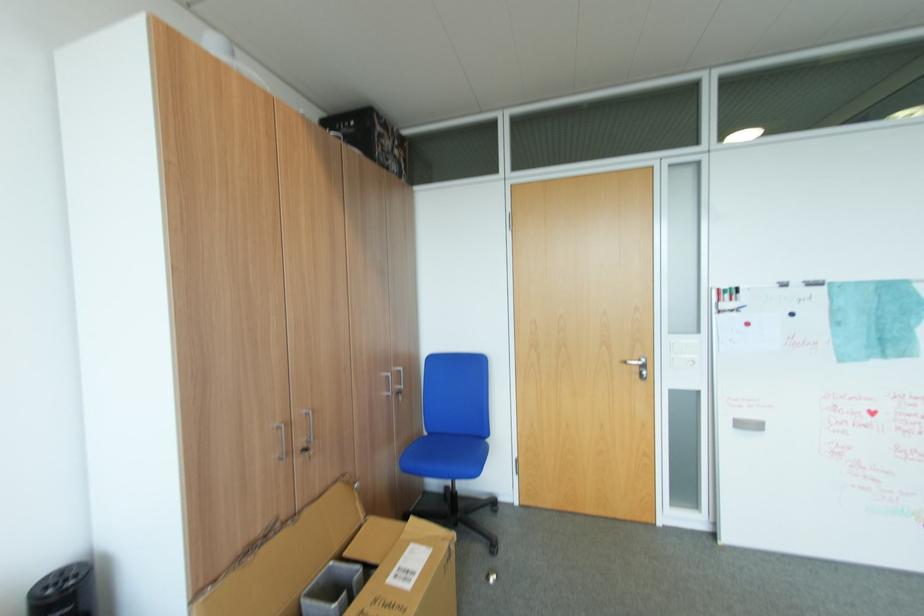
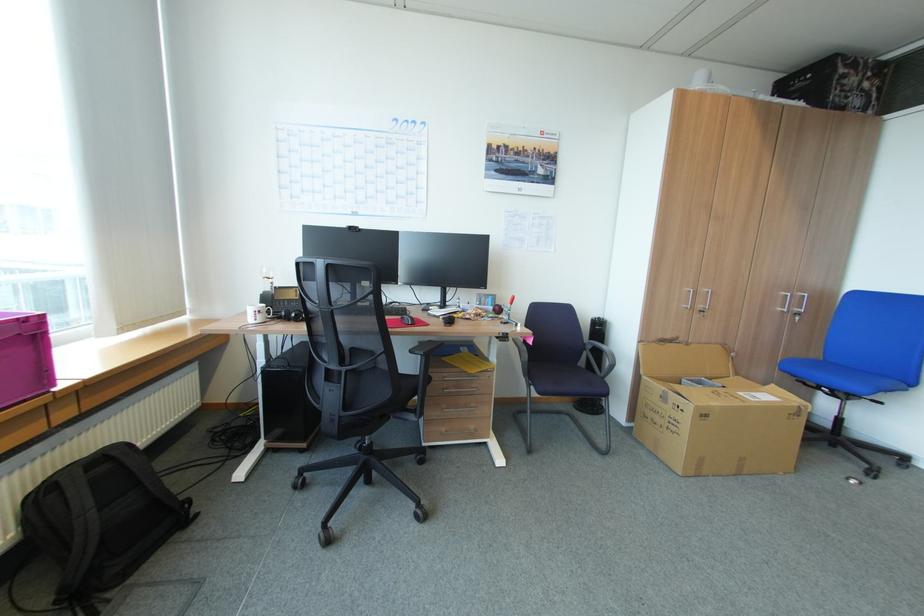
Find the pixel in the second image that matches (x=293, y=454) in the first image.

(698, 307)